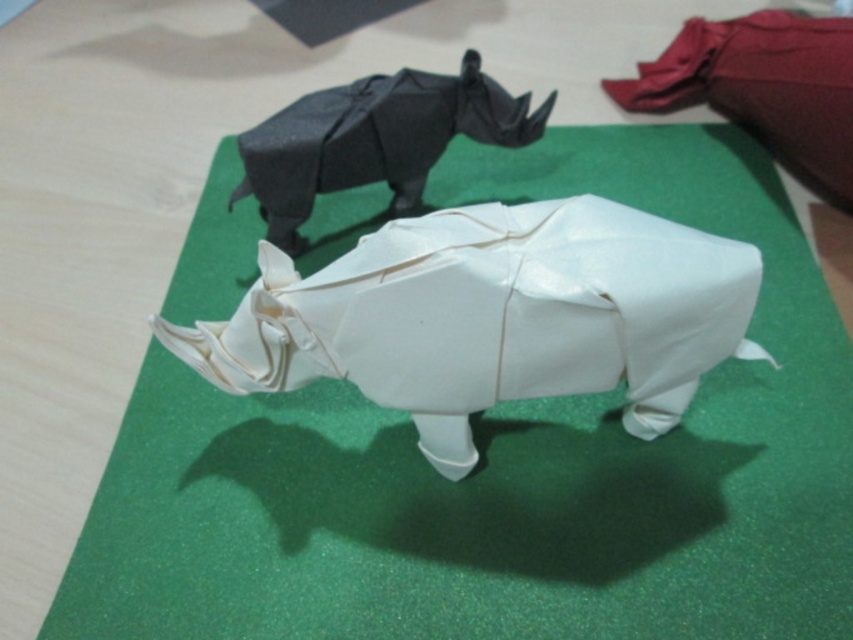
Question: Does white paper rhino at center appear under black paper rhino at upper center?

Choices:
 (A) no
 (B) yes

Answer: (B)

Question: Which object appears farthest from the camera in this image?

Choices:
 (A) black paper rhino at upper center
 (B) white paper rhino at center

Answer: (A)

Question: Is white paper rhino at center wider than black paper rhino at upper center?

Choices:
 (A) no
 (B) yes

Answer: (B)

Question: Among these points, which one is nearest to the camera?

Choices:
 (A) (421, 150)
 (B) (606, 291)

Answer: (B)

Question: Where is white paper rhino at center located in relation to black paper rhino at upper center in the image?

Choices:
 (A) right
 (B) left

Answer: (A)